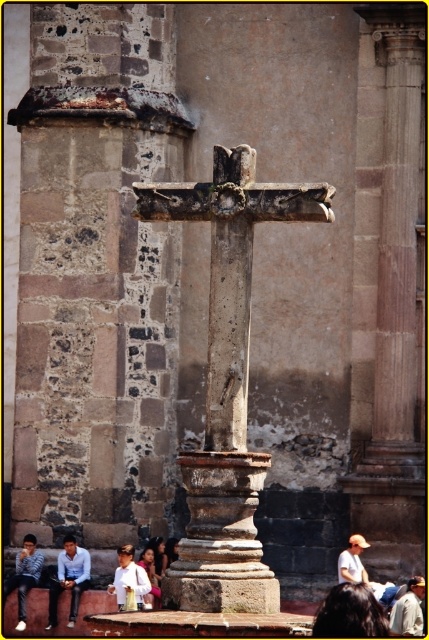
Is point (81, 560) less distant than point (145, 580)?

No, it is behind (145, 580).

Who is more forward, (72, 577) or (145, 580)?

Point (145, 580) is in front.

Where is `blue shirt at lower left`? blue shirt at lower left is located at coordinates (69, 579).

Measure the distance between blue shirt at lower left and light brown leather hat at lower right.

blue shirt at lower left is 14.06 meters from light brown leather hat at lower right.

Describe the element at coordinates (69, 579) in the screenshot. Image resolution: width=429 pixels, height=640 pixels. I see `blue shirt at lower left` at that location.

Is point (85, 563) positioned after point (392, 611)?

That is True.

Identify the location of blue shirt at lower left. This screenshot has height=640, width=429. (69, 579).

Does rusty stone cross at center appear on the left side of blue striped shirt at lower left?

Incorrect, rusty stone cross at center is not on the left side of blue striped shirt at lower left.

Does point (207, 212) come behind point (21, 630)?

No, it is in front of (21, 630).

The height and width of the screenshot is (640, 429). In order to click on rusty stone cross at center in this screenshot , I will do `click(230, 268)`.

I want to click on rusty stone cross at center, so click(230, 268).